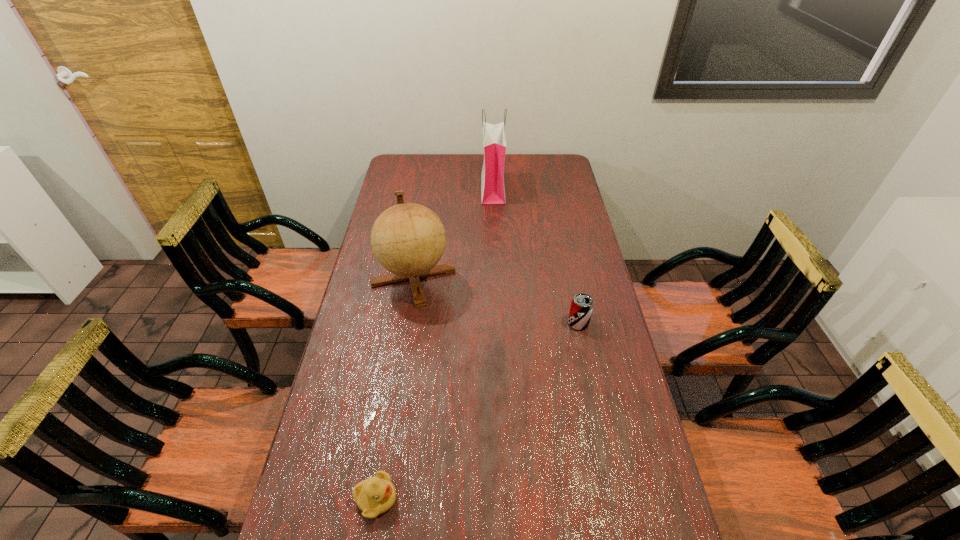
Where is `vacant space located on the surface of the globe`? vacant space located on the surface of the globe is located at coordinates (396, 392).

I want to click on free spot located on the back of the second shortest object, so click(x=571, y=288).

The width and height of the screenshot is (960, 540). What are the coordinates of `vacant space located on the front-facing side of the duckling` in the screenshot? It's located at (492, 498).

At what (x,y) coordinates should I click in order to perform the action: click on object present at the far edge. Please return your answer as a coordinate pair (x, y). Looking at the image, I should click on (494, 138).

The width and height of the screenshot is (960, 540). I want to click on globe at the left edge, so click(408, 239).

The height and width of the screenshot is (540, 960). Find the location of `duckling located at the left edge`. duckling located at the left edge is located at coordinates (375, 495).

Locate an element on the screen. object that is at the right edge is located at coordinates (581, 308).

Find the location of a particular element. This screenshot has width=960, height=540. vacant space at the left edge of the desktop is located at coordinates (374, 295).

Where is `vacant position at the right edge of the desktop`? This screenshot has width=960, height=540. vacant position at the right edge of the desktop is located at coordinates (600, 384).

Locate an element on the screen. The height and width of the screenshot is (540, 960). free space at the far right corner is located at coordinates (548, 175).